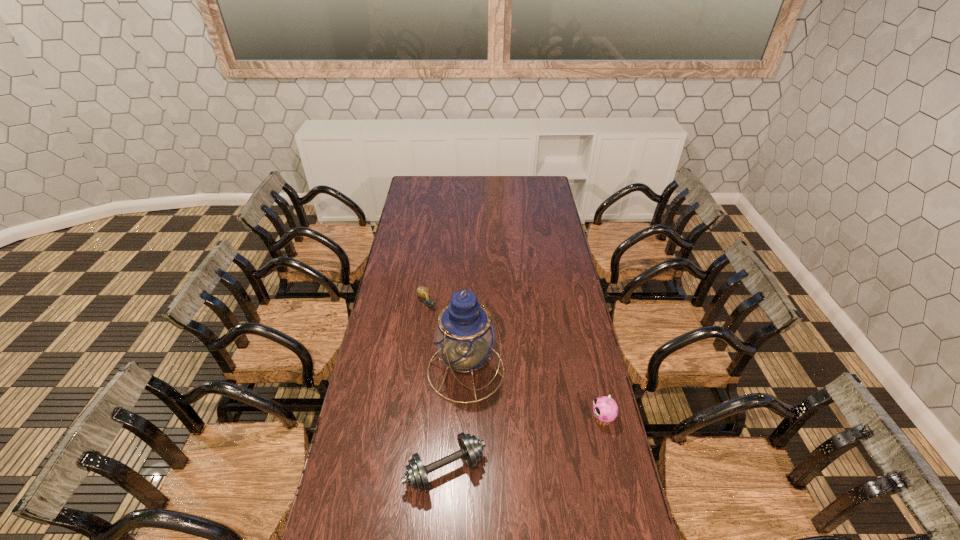
The image size is (960, 540). In the image, there is a desktop. In order to click on vacant space at the near edge in this screenshot , I will do `click(426, 528)`.

In the image, there is a desktop. Find the location of `vacant space at the left edge`. vacant space at the left edge is located at coordinates (402, 256).

This screenshot has width=960, height=540. In the image, there is a desktop. Find the location of `free space at the right edge`. free space at the right edge is located at coordinates (580, 409).

Image resolution: width=960 pixels, height=540 pixels. I want to click on empty space that is in between the shortest object and the nearest object, so click(x=436, y=387).

You are a GUI agent. You are given a task and a screenshot of the screen. Output one action in this format:
    pyautogui.click(x=<x>, y=<y>)
    Task: Click on the vacant space that is in between the rightmost object and the shortest object
    
    Given the screenshot: What is the action you would take?
    pyautogui.click(x=515, y=361)

In order to click on free space between the shortest object and the dumbbell in this screenshot , I will do `click(436, 387)`.

The image size is (960, 540). Find the location of `free space between the third shortest object and the escargot`. free space between the third shortest object and the escargot is located at coordinates (515, 361).

You are a GUI agent. You are given a task and a screenshot of the screen. Output one action in this format:
    pyautogui.click(x=<x>, y=<y>)
    Task: Click on the empty space that is in between the rightmost object and the second farthest object
    The height and width of the screenshot is (540, 960).
    Given the screenshot: What is the action you would take?
    click(535, 394)

The image size is (960, 540). In order to click on unoccupied position between the tallest object and the second shortest object in this screenshot , I will do coord(456,421).

This screenshot has width=960, height=540. I want to click on free space between the dumbbell and the lantern, so click(x=456, y=421).